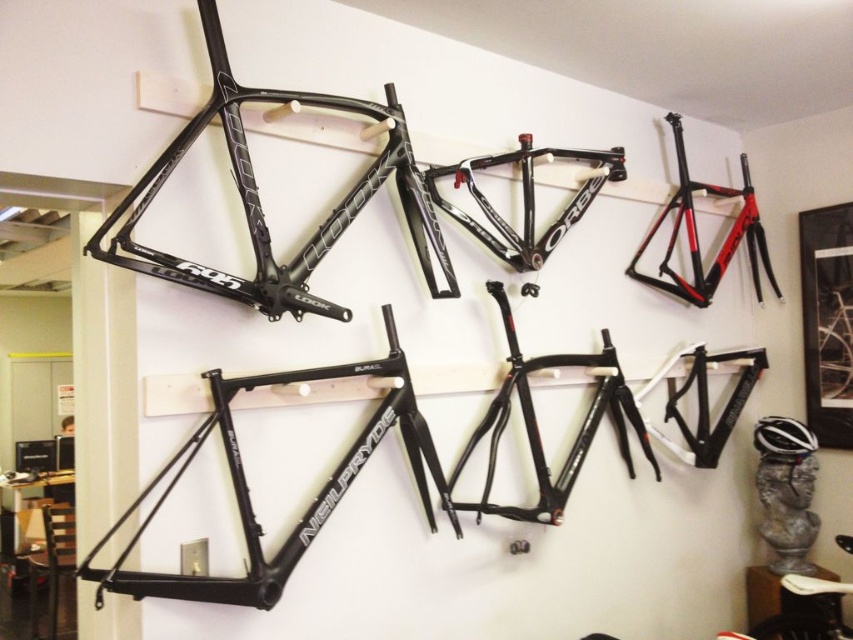
Question: Does black matte bicycle frame at center have a lesser width compared to matte black frame at upper center?

Choices:
 (A) no
 (B) yes

Answer: (A)

Question: Does black matte bicycle frame at center have a greater width compared to matte black frame at upper center?

Choices:
 (A) yes
 (B) no

Answer: (A)

Question: Can you confirm if black matte bicycle frame at center is positioned to the right of matte black frame at upper center?

Choices:
 (A) no
 (B) yes

Answer: (B)

Question: Among these points, which one is farthest from the camera?

Choices:
 (A) (514, 380)
 (B) (349, 208)

Answer: (A)

Question: Among these points, which one is farthest from the camera?

Choices:
 (A) (224, 284)
 (B) (531, 412)

Answer: (B)

Question: Which point is closer to the camera?

Choices:
 (A) (692, 435)
 (B) (206, 4)

Answer: (B)